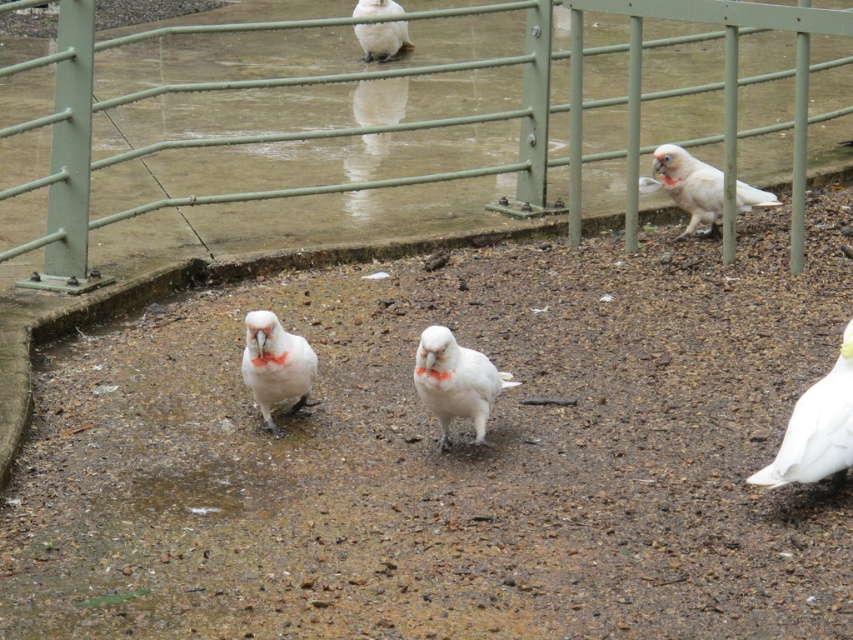
Based on the scene description, where is the white matte parrot at center located in the image?

The white matte parrot at center is located at point coordinates of 0.597 in the x axis and 0.535 in the y axis.